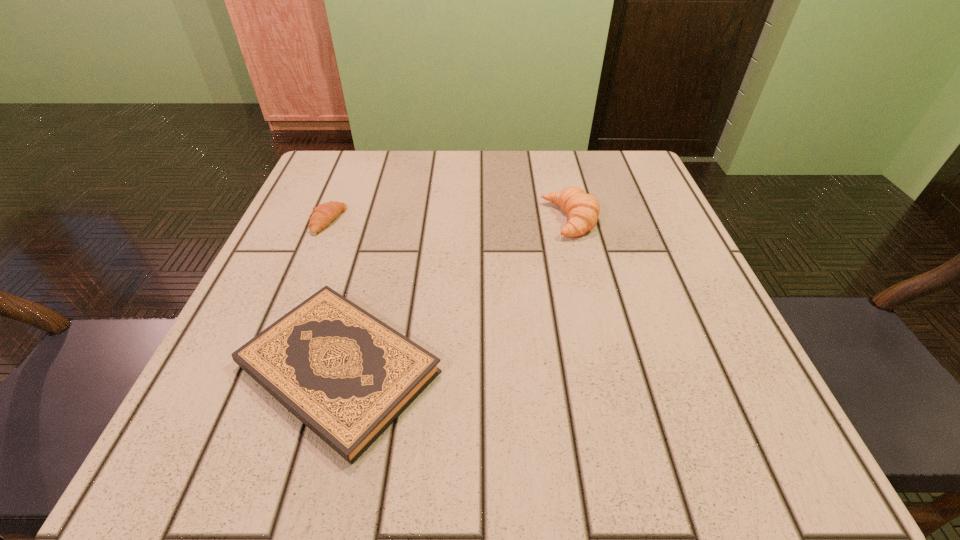
Where is `free spot that satisfies the following two spatial constraints: 1. on the front side of the nearest object; 2. on the right side of the shorter crescent roll`? The image size is (960, 540). free spot that satisfies the following two spatial constraints: 1. on the front side of the nearest object; 2. on the right side of the shorter crescent roll is located at coordinates tap(267, 369).